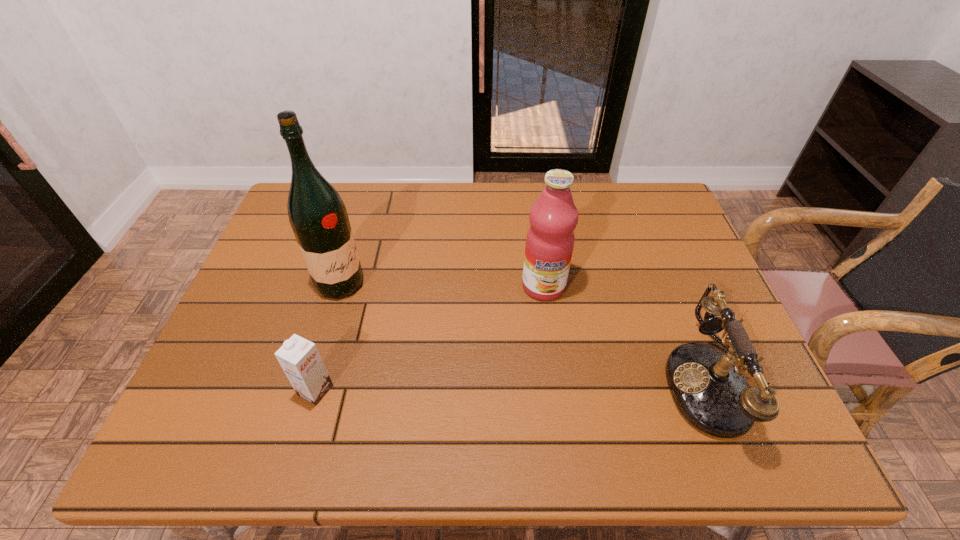
Where is `free space at the far edge of the desktop`? free space at the far edge of the desktop is located at coordinates (390, 224).

Where is `free region at the near edge of the desktop`? free region at the near edge of the desktop is located at coordinates (559, 386).

In the image, there is a desktop. Find the location of `free space at the left edge`. free space at the left edge is located at coordinates (275, 305).

The width and height of the screenshot is (960, 540). What are the coordinates of `free space at the right edge of the desktop` in the screenshot? It's located at (721, 335).

The image size is (960, 540). Find the location of `vacant area at the far right corner`. vacant area at the far right corner is located at coordinates (656, 190).

Locate an element on the screen. The image size is (960, 540). vacant space that is in between the chocolate milk and the telephone is located at coordinates (516, 387).

You are a GUI agent. You are given a task and a screenshot of the screen. Output one action in this format:
    pyautogui.click(x=<x>, y=<y>)
    Task: Click on the vacant area that lies between the second shortest object and the third shortest object
    The image size is (960, 540).
    Given the screenshot: What is the action you would take?
    [x=630, y=334]

You are a GUI agent. You are given a task and a screenshot of the screen. Output one action in this format:
    pyautogui.click(x=<x>, y=<y>)
    Task: Click on the vacant area between the second tallest object and the shortest object
    
    Given the screenshot: What is the action you would take?
    pyautogui.click(x=429, y=338)

At what (x,y) coordinates should I click in order to perform the action: click on empty space that is in between the third object from left to right and the liquor. Please return your answer as a coordinate pair (x, y). This screenshot has width=960, height=540. Looking at the image, I should click on (442, 285).

Find the location of `free spot between the tallest object and the shortest object`. free spot between the tallest object and the shortest object is located at coordinates (328, 337).